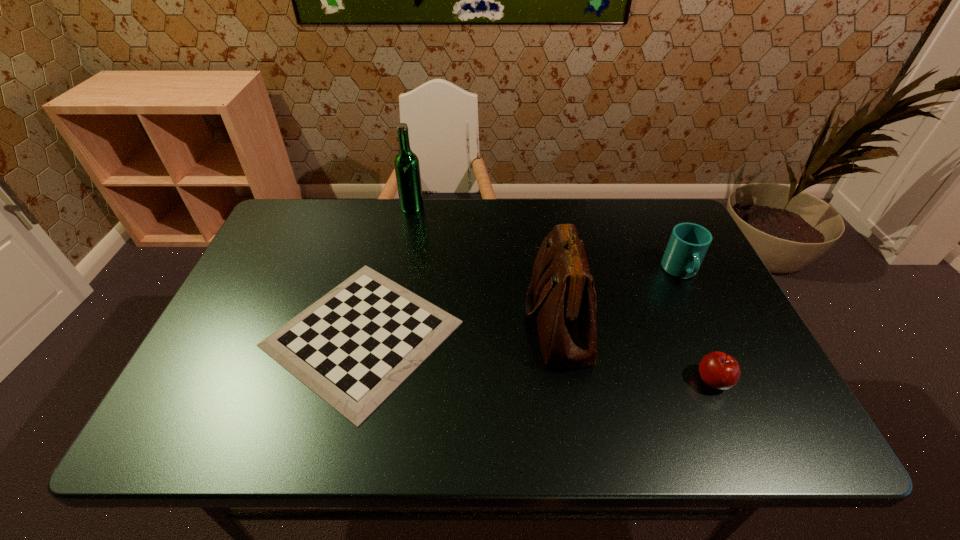
Where is `vacant position in the image that satisfies the following two spatial constraints: 1. on the front side of the apple; 2. on the left side of the shoulder bag`? The height and width of the screenshot is (540, 960). vacant position in the image that satisfies the following two spatial constraints: 1. on the front side of the apple; 2. on the left side of the shoulder bag is located at coordinates (570, 380).